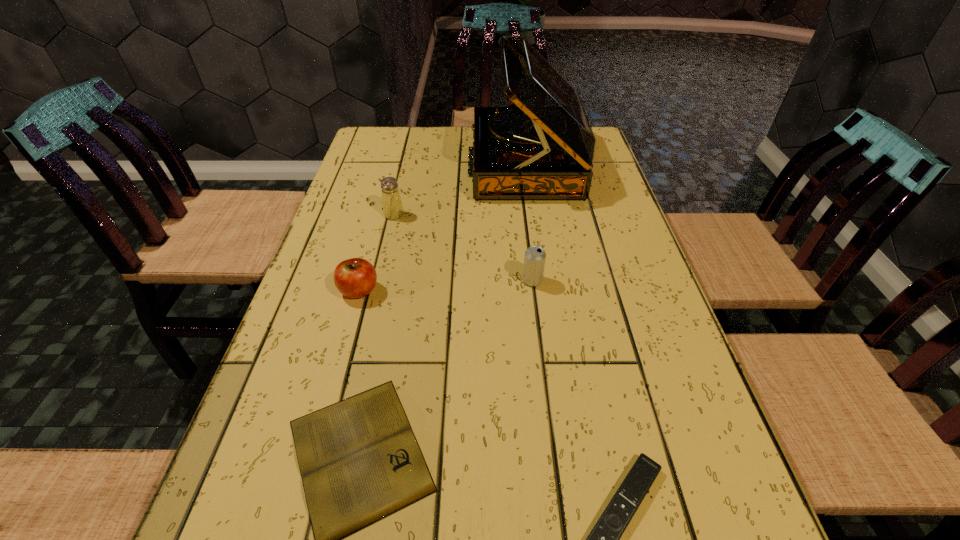
Identify the location of free space that is in between the beer can and the record player. (529, 222).

You are a GUI agent. You are given a task and a screenshot of the screen. Output one action in this format:
    pyautogui.click(x=<x>, y=<y>)
    Task: Click on the object that is the fourth closest to the remote control
    This screenshot has height=540, width=960.
    Given the screenshot: What is the action you would take?
    pyautogui.click(x=543, y=149)

Locate which object is the closest to the beer can. Please provide its 2D coordinates. Your answer should be formatted as a tuple, i.e. [(x, y)], where the tuple contains the x and y coordinates of a point satisfying the conditions above.

[(543, 149)]

Locate an element on the screen. The height and width of the screenshot is (540, 960). vacant space that satisfies the following two spatial constraints: 1. on the front-facing side of the tallest object; 2. on the front side of the apple is located at coordinates click(x=543, y=291).